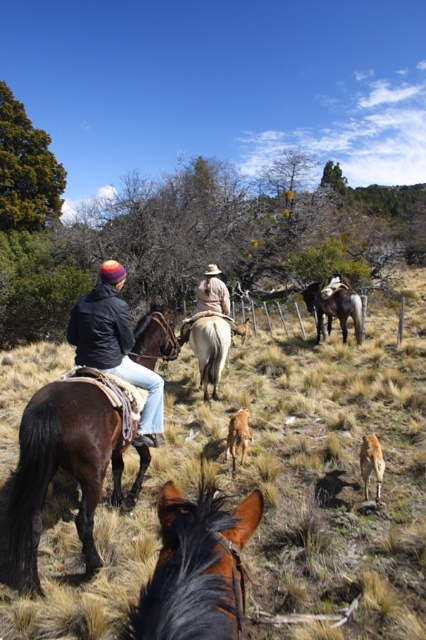
Between brown glossy horse at center and light brown leather jacket at center, which one appears on the left side from the viewer's perspective?

From the viewer's perspective, light brown leather jacket at center appears more on the left side.

Is point (342, 317) more distant than point (195, 305)?

No.

Identify the location of brown glossy horse at center. The image size is (426, 640). (334, 308).

Who is more forward, (88, 413) or (224, 314)?

Positioned in front is point (88, 413).

Is shiny brown horse at left taller than light brown leather jacket at center?

In fact, shiny brown horse at left may be shorter than light brown leather jacket at center.

This screenshot has width=426, height=640. Describe the element at coordinates (63, 468) in the screenshot. I see `shiny brown horse at left` at that location.

Image resolution: width=426 pixels, height=640 pixels. What are the coordinates of `shiny brown horse at left` in the screenshot? It's located at (63, 468).

Which of these two, brown rough horse at upper left or shiny brown horse at center, stands shorter?

shiny brown horse at center

Describe the element at coordinates (273, 490) in the screenshot. Image resolution: width=426 pixels, height=640 pixels. I see `brown rough horse at upper left` at that location.

This screenshot has height=640, width=426. Identify the location of brown rough horse at upper left. (273, 490).